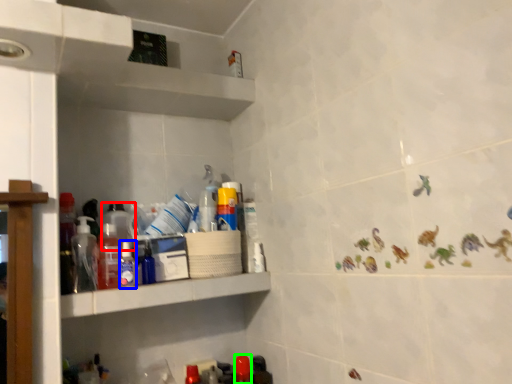
Question: Considering the real-world distances, which object is closest to bottle (highlighted by a red box)? bottle (highlighted by a blue box) or bottle (highlighted by a green box).

Choices:
 (A) bottle
 (B) bottle

Answer: (A)